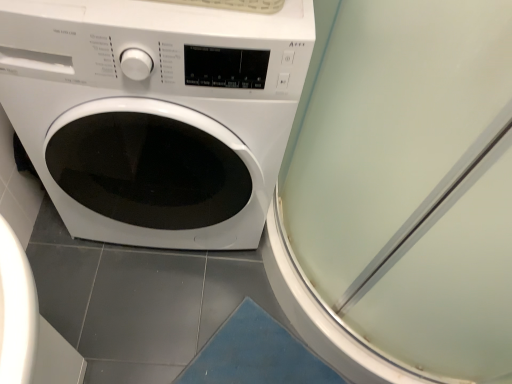
Question: Based on their sizes in the image, would you say white glossy washing machine at center is bigger or smaller than transparent plastic screen door at upper right?

Choices:
 (A) big
 (B) small

Answer: (A)

Question: Is white glossy washing machine at center to the left or to the right of transparent plastic screen door at upper right in the image?

Choices:
 (A) left
 (B) right

Answer: (A)

Question: From a real-world perspective, is white glossy washing machine at center positioned above or below transparent plastic screen door at upper right?

Choices:
 (A) above
 (B) below

Answer: (B)

Question: Is transparent plastic screen door at upper right wider or thinner than white glossy washing machine at center?

Choices:
 (A) wide
 (B) thin

Answer: (A)

Question: Is point (311, 284) positioned closer to the camera than point (237, 77)?

Choices:
 (A) closer
 (B) farther

Answer: (B)

Question: From the image's perspective, is transparent plastic screen door at upper right above or below white glossy washing machine at center?

Choices:
 (A) above
 (B) below

Answer: (B)

Question: Considering their positions, is transparent plastic screen door at upper right located in front of or behind white glossy washing machine at center?

Choices:
 (A) front
 (B) behind

Answer: (A)